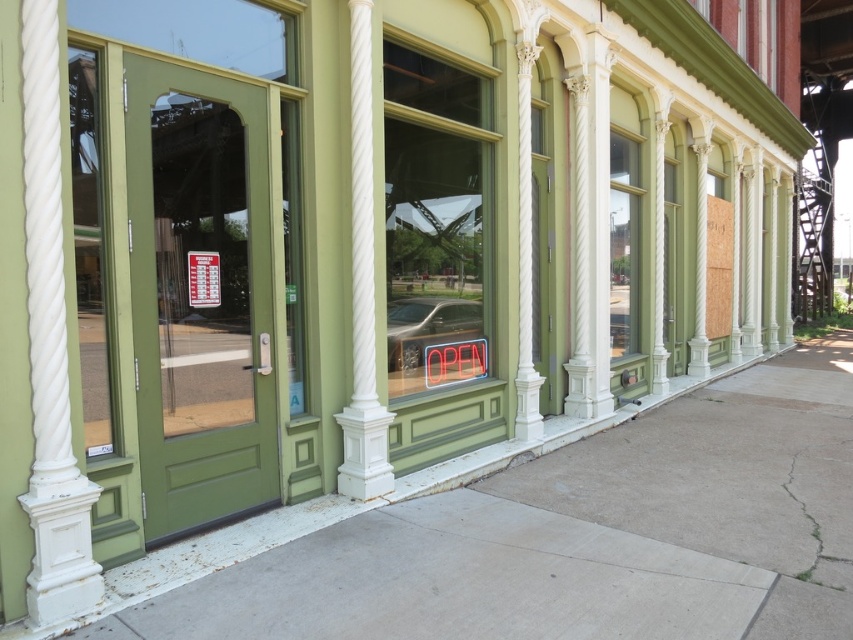
From the picture: Measure the distance between point [74,547] and camera.

A distance of 3.41 meters exists between point [74,547] and camera.

Which is behind, point (39, 492) or point (386, 436)?

Positioned behind is point (386, 436).

Where is `white textured column at left`? The height and width of the screenshot is (640, 853). white textured column at left is located at coordinates (50, 348).

Is gray concrete sidewalk at center wider than white textured column at left?

Yes, gray concrete sidewalk at center is wider than white textured column at left.

Between gray concrete sidewalk at center and white textured column at left, which one appears on the right side from the viewer's perspective?

gray concrete sidewalk at center is more to the right.

Where is `gray concrete sidewalk at center`? The image size is (853, 640). gray concrete sidewalk at center is located at coordinates (554, 536).

Is gray concrete sidewalk at center smaller than green glass door at left?

No.

Between point (582, 573) and point (91, 163), which one is positioned in front?

Positioned in front is point (91, 163).

I want to click on gray concrete sidewalk at center, so click(554, 536).